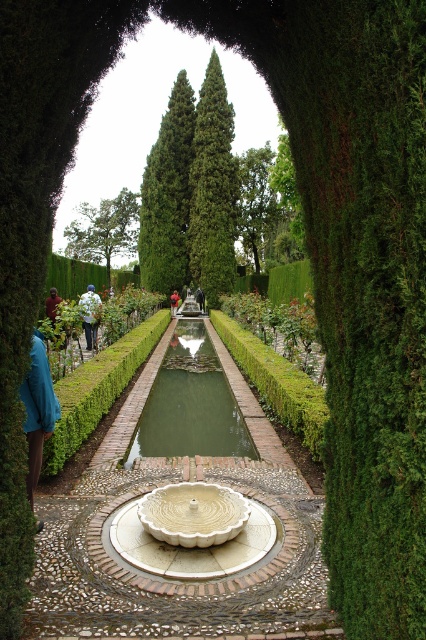
Question: Which object is positioned closest to the green fabric person at center?

Choices:
 (A) red shirt at left
 (B) white marble fountain at center
 (C) white cotton jacket at center
 (D) teal fabric jacket at lower left

Answer: (C)

Question: In this image, where is teal fabric jacket at lower left located relative to white cotton jacket at center?

Choices:
 (A) below
 (B) above

Answer: (A)

Question: Considering the real-world distances, which object is closest to the teal fabric jacket at lower left?

Choices:
 (A) white cotton jacket at center
 (B) green fabric person at center

Answer: (A)

Question: Which of the following is the closest to the observer?

Choices:
 (A) [172, 298]
 (B) [86, 292]
 (C) [48, 312]

Answer: (C)

Question: Can you confirm if teal fabric jacket at lower left is positioned to the right of blue fabric at center?

Choices:
 (A) no
 (B) yes

Answer: (B)

Question: Does green concrete pond at center lie behind teal fabric jacket at lower left?

Choices:
 (A) no
 (B) yes

Answer: (B)